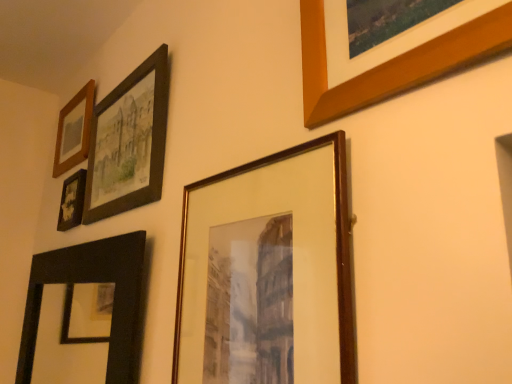
Locate an element on the screen. This screenshot has height=384, width=512. wooden picture frame at upper right, the first picture frame in the right-to-left sequence is located at coordinates (393, 63).

The image size is (512, 384). What do you see at coordinates (91, 281) in the screenshot? I see `black matte mirror at lower left, arranged as the 3th picture frame when viewed from the left` at bounding box center [91, 281].

Where is `wooden picture frame at upper right, the 6th picture frame viewed from the left`? The height and width of the screenshot is (384, 512). wooden picture frame at upper right, the 6th picture frame viewed from the left is located at coordinates (393, 63).

Between wooden frame at center, the fifth picture frame viewed from the left, and matte black photo frame at upper left, the 5th picture frame from the right, which one appears on the right side from the viewer's perspective?

From the viewer's perspective, wooden frame at center, the fifth picture frame viewed from the left, appears more on the right side.

Is wooden frame at center, the fifth picture frame viewed from the left, not within matte black photo frame at upper left, the 5th picture frame from the right?

That's correct, wooden frame at center, the fifth picture frame viewed from the left, is outside of matte black photo frame at upper left, the 5th picture frame from the right.

Could you tell me if wooden frame at center, the fifth picture frame viewed from the left, is facing matte black photo frame at upper left, the 2th picture frame viewed from the left?

No, wooden frame at center, the fifth picture frame viewed from the left, does not turn towards matte black photo frame at upper left, the 2th picture frame viewed from the left.

Which of these two, wooden frame at center, placed as the 2th picture frame when sorted from right to left, or matte black photo frame at upper left, the 5th picture frame from the right, stands taller?

With more height is wooden frame at center, placed as the 2th picture frame when sorted from right to left.

How many degrees apart are the facing directions of black matte mirror at lower left, arranged as the 3th picture frame when viewed from the left, and matte black photo frame at upper left, the 2th picture frame viewed from the left?

The angle between the facing direction of black matte mirror at lower left, arranged as the 3th picture frame when viewed from the left, and the facing direction of matte black photo frame at upper left, the 2th picture frame viewed from the left, is 0.0758 degrees.

Is point (83, 265) positioned before point (71, 184)?

Yes, it is in front of point (71, 184).

Is black matte mirror at lower left, arranged as the fourth picture frame when viewed from the right, to the right of matte black photo frame at upper left, the 5th picture frame from the right, from the viewer's perspective?

Yes.

Does black matte mirror at lower left, arranged as the fourth picture frame when viewed from the right, have a lesser width compared to matte black photo frame at upper left, the 5th picture frame from the right?

No, black matte mirror at lower left, arranged as the fourth picture frame when viewed from the right, is not thinner than matte black photo frame at upper left, the 5th picture frame from the right.

From the image's perspective, is wooden picture frame at upper right, the first picture frame in the right-to-left sequence, above wooden frame at center, the fifth picture frame viewed from the left?

Yes, from the image's perspective, wooden picture frame at upper right, the first picture frame in the right-to-left sequence, is on top of wooden frame at center, the fifth picture frame viewed from the left.

Is wooden frame at center, the fifth picture frame viewed from the left, at the back of wooden picture frame at upper right, the first picture frame in the right-to-left sequence?

No, wooden picture frame at upper right, the first picture frame in the right-to-left sequence, is not facing away from wooden frame at center, the fifth picture frame viewed from the left.

Does wooden picture frame at upper right, the 6th picture frame viewed from the left, appear on the right side of wooden frame at center, placed as the 2th picture frame when sorted from right to left?

Yes, wooden picture frame at upper right, the 6th picture frame viewed from the left, is to the right of wooden frame at center, placed as the 2th picture frame when sorted from right to left.

Which of these two, wooden picture frame at upper right, the first picture frame in the right-to-left sequence, or wooden frame at center, the fifth picture frame viewed from the left, is bigger?

wooden frame at center, the fifth picture frame viewed from the left.

Is wooden frame at upper left, the 6th picture frame positioned from the right, at the back of matte black frame at upper left, the 3th picture frame from the right?

That's not correct — matte black frame at upper left, the 3th picture frame from the right, is not looking away from wooden frame at upper left, the 6th picture frame positioned from the right.

Is matte black frame at upper left, the 3th picture frame from the right, wider or thinner than wooden frame at upper left, the 6th picture frame positioned from the right?

In the image, matte black frame at upper left, the 3th picture frame from the right, appears to be more narrow than wooden frame at upper left, the 6th picture frame positioned from the right.

Is matte black frame at upper left, the 3th picture frame from the right, taller than wooden frame at upper left, the 6th picture frame positioned from the right?

Correct, matte black frame at upper left, the 3th picture frame from the right, is much taller as wooden frame at upper left, the 6th picture frame positioned from the right.

Are matte black frame at upper left, the 3th picture frame from the right, and wooden frame at upper left, the 1th picture frame positioned from the left, beside each other?

No, matte black frame at upper left, the 3th picture frame from the right, is not with wooden frame at upper left, the 1th picture frame positioned from the left.

From the image's perspective, is wooden frame at upper left, the 6th picture frame positioned from the right, located above or below wooden picture frame at upper right, the 6th picture frame viewed from the left?

wooden frame at upper left, the 6th picture frame positioned from the right, is below wooden picture frame at upper right, the 6th picture frame viewed from the left.

Between wooden frame at upper left, the 6th picture frame positioned from the right, and wooden picture frame at upper right, the first picture frame in the right-to-left sequence, which one has smaller width?

With smaller width is wooden picture frame at upper right, the first picture frame in the right-to-left sequence.

Between wooden frame at upper left, the 1th picture frame positioned from the left, and wooden picture frame at upper right, the first picture frame in the right-to-left sequence, which one has larger size?

With larger size is wooden frame at upper left, the 1th picture frame positioned from the left.

From the wooden picture frame at upper right, the 6th picture frame viewed from the left, count the 5th picture frame to the left and point to it. Please provide its 2D coordinates.

[(74, 130)]

Which is behind, matte black frame at upper left, the 3th picture frame from the right, or wooden frame at center, the fifth picture frame viewed from the left?

matte black frame at upper left, the 3th picture frame from the right, is further from the camera.

From the image's perspective, is matte black frame at upper left, the fourth picture frame viewed from the left, positioned above or below wooden frame at center, placed as the 2th picture frame when sorted from right to left?

matte black frame at upper left, the fourth picture frame viewed from the left, is situated higher than wooden frame at center, placed as the 2th picture frame when sorted from right to left, in the image.

Based on their positions, is matte black frame at upper left, the fourth picture frame viewed from the left, located to the left or right of wooden frame at center, the fifth picture frame viewed from the left?

From the image, it's evident that matte black frame at upper left, the fourth picture frame viewed from the left, is to the left of wooden frame at center, the fifth picture frame viewed from the left.

From the image's perspective, is wooden frame at center, the fifth picture frame viewed from the left, on black matte mirror at lower left, arranged as the 3th picture frame when viewed from the left?

Yes.

Can you confirm if wooden frame at center, placed as the 2th picture frame when sorted from right to left, is shorter than black matte mirror at lower left, arranged as the fourth picture frame when viewed from the right?

No, wooden frame at center, placed as the 2th picture frame when sorted from right to left, is not shorter than black matte mirror at lower left, arranged as the fourth picture frame when viewed from the right.

Locate an element on the screen. the 1st picture frame above when counting from the wooden frame at center, placed as the 2th picture frame when sorted from right to left (from the image's perspective) is located at coordinates (72, 201).

Locate an element on the screen. the 1st picture frame to the left of the black matte mirror at lower left, arranged as the 3th picture frame when viewed from the left, counting from the anchor's position is located at coordinates (72, 201).

Based on their spatial positions, is matte black photo frame at upper left, the 2th picture frame viewed from the left, or matte black frame at upper left, the fourth picture frame viewed from the left, closer to black matte mirror at lower left, arranged as the fourth picture frame when viewed from the right?

matte black photo frame at upper left, the 2th picture frame viewed from the left, lies closer to black matte mirror at lower left, arranged as the fourth picture frame when viewed from the right, than the other object.

Based on their spatial positions, is matte black photo frame at upper left, the 5th picture frame from the right, or wooden frame at center, placed as the 2th picture frame when sorted from right to left, further from matte black frame at upper left, the 3th picture frame from the right?

The object further to matte black frame at upper left, the 3th picture frame from the right, is wooden frame at center, placed as the 2th picture frame when sorted from right to left.

Based on their spatial positions, is black matte mirror at lower left, arranged as the 3th picture frame when viewed from the left, or wooden frame at center, placed as the 2th picture frame when sorted from right to left, further from wooden picture frame at upper right, the first picture frame in the right-to-left sequence?

The object further to wooden picture frame at upper right, the first picture frame in the right-to-left sequence, is black matte mirror at lower left, arranged as the 3th picture frame when viewed from the left.

Considering their positions, is black matte mirror at lower left, arranged as the 3th picture frame when viewed from the left, positioned closer to wooden frame at upper left, the 6th picture frame positioned from the right, than matte black photo frame at upper left, the 2th picture frame viewed from the left?

Based on the image, matte black photo frame at upper left, the 2th picture frame viewed from the left, appears to be nearer to wooden frame at upper left, the 6th picture frame positioned from the right.

Estimate the real-world distances between objects in this image. Which object is closer to wooden frame at center, placed as the 2th picture frame when sorted from right to left, wooden frame at upper left, the 1th picture frame positioned from the left, or wooden picture frame at upper right, the first picture frame in the right-to-left sequence?

wooden picture frame at upper right, the first picture frame in the right-to-left sequence, is closer to wooden frame at center, placed as the 2th picture frame when sorted from right to left.

When comparing their distances from black matte mirror at lower left, arranged as the 3th picture frame when viewed from the left, does wooden frame at center, the fifth picture frame viewed from the left, or wooden frame at upper left, the 1th picture frame positioned from the left, seem further?

wooden frame at upper left, the 1th picture frame positioned from the left.

Which object lies further to the anchor point wooden picture frame at upper right, the 6th picture frame viewed from the left, matte black frame at upper left, the fourth picture frame viewed from the left, or wooden frame at upper left, the 6th picture frame positioned from the right?

Among the two, wooden frame at upper left, the 6th picture frame positioned from the right, is located further to wooden picture frame at upper right, the 6th picture frame viewed from the left.

Based on their spatial positions, is black matte mirror at lower left, arranged as the 3th picture frame when viewed from the left, or wooden frame at center, the fifth picture frame viewed from the left, further from matte black frame at upper left, the 3th picture frame from the right?

wooden frame at center, the fifth picture frame viewed from the left, is positioned further to the anchor matte black frame at upper left, the 3th picture frame from the right.

The width and height of the screenshot is (512, 384). What are the coordinates of `picture frame positioned between matte black frame at upper left, the fourth picture frame viewed from the left, and wooden frame at upper left, the 6th picture frame positioned from the right, from near to far` in the screenshot? It's located at (72, 201).

The image size is (512, 384). Identify the location of picture frame between wooden frame at center, the fifth picture frame viewed from the left, and matte black frame at upper left, the 3th picture frame from the right, along the z-axis. (91, 281).

The width and height of the screenshot is (512, 384). Identify the location of picture frame between black matte mirror at lower left, arranged as the 3th picture frame when viewed from the left, and matte black photo frame at upper left, the 5th picture frame from the right, in the front-back direction. (129, 142).